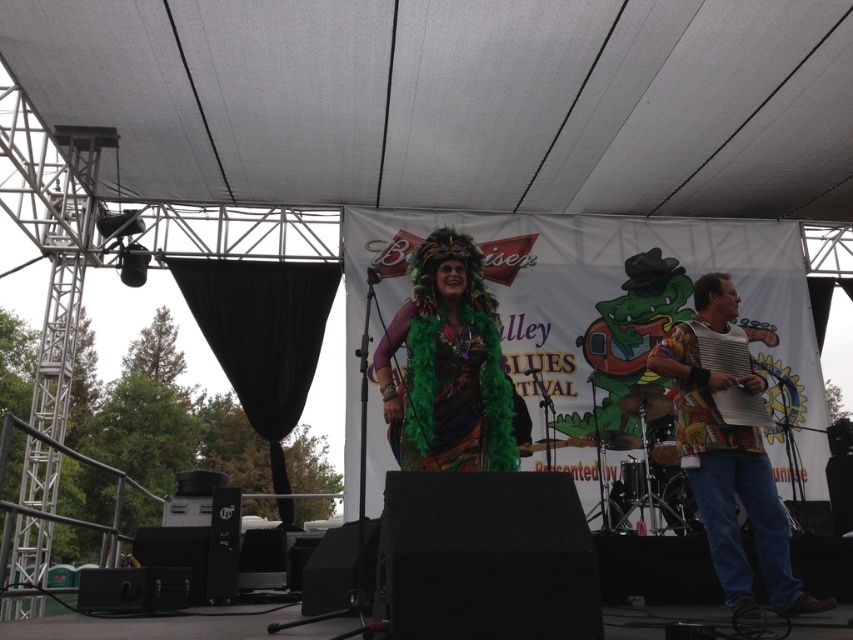
You are a photographer at the Blues Festival trying to capture the stage setup. You notice the multicolored feather boa at center and the printed fabric accordion at right. Which object is positioned to the left of the other?

The multicolored feather boa at center is to the left of the printed fabric accordion at right.

You are a stagehand at the Blues Festival and need to adjust the position of the printed fabric accordion at right and the textured yellow accordion at center. According to the current setup, which accordion is positioned lower on the stage?

The printed fabric accordion at right is positioned below the textured yellow accordion at center, so it is lower on the stage.